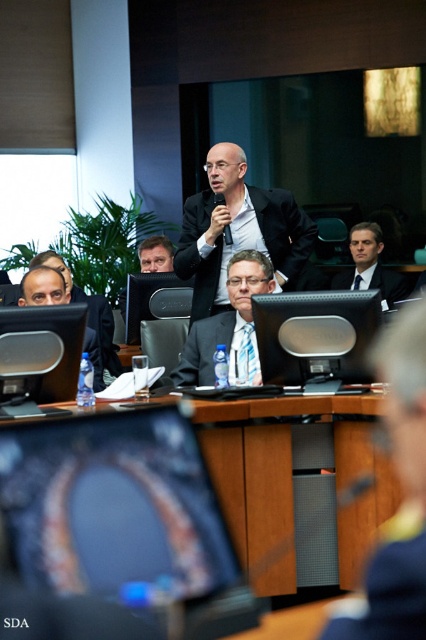
Question: Can you confirm if blue striped tie at center is wider than dark gray suit at center?

Choices:
 (A) yes
 (B) no

Answer: (B)

Question: Is black plastic monitor at center in front of matte black monitor at center?

Choices:
 (A) no
 (B) yes

Answer: (A)

Question: Which object is positioned farthest from the matte black monitor at center?

Choices:
 (A) matte black suit at center
 (B) black plastic monitor at center

Answer: (B)

Question: Does black matte suit at center lie behind matte black monitor at center?

Choices:
 (A) yes
 (B) no

Answer: (A)

Question: Which object is farther from the camera taking this photo?

Choices:
 (A) blue striped tie at center
 (B) black plastic monitor at center
 (C) dark gray suit at center

Answer: (C)

Question: Which point is closer to the camera taking this photo?

Choices:
 (A) (37, 333)
 (B) (221, 486)
 (C) (190, 349)
 (D) (284, 218)

Answer: (A)